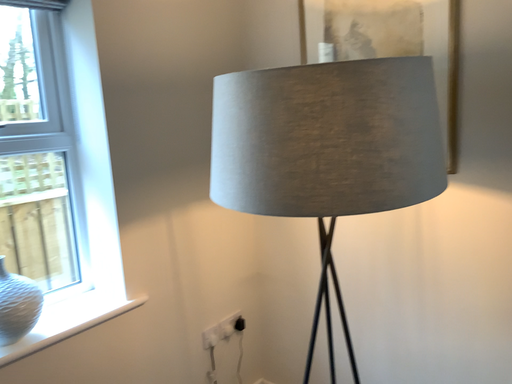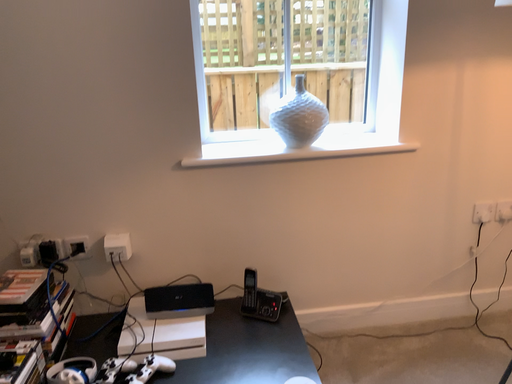
Question: How did the camera likely rotate when shooting the video?

Choices:
 (A) rotated upward
 (B) rotated downward

Answer: (B)